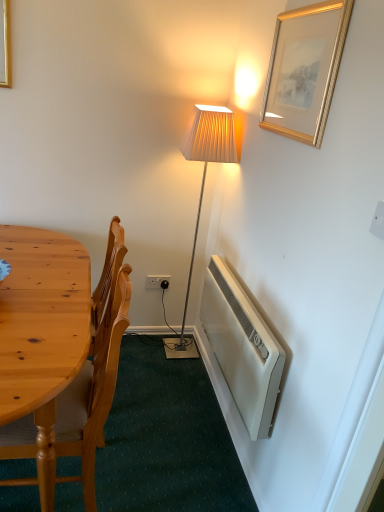
The height and width of the screenshot is (512, 384). In order to click on wooden chair at left in this screenshot , I will do `click(92, 396)`.

What is the approximate width of wooden chair at left?

It is 20.51 inches.

Describe the element at coordinates (305, 69) in the screenshot. The width and height of the screenshot is (384, 512). I see `gold/gilded picture frame at upper right` at that location.

This screenshot has height=512, width=384. I want to click on gold/gilded picture frame at upper right, so click(x=305, y=69).

Identify the location of white plastic radiator at lower right. The image size is (384, 512). (242, 347).

Measure the distance between point (x=242, y=315) and camera.

Point (x=242, y=315) is 5.57 feet from camera.

I want to click on white plastic power outlet at lower center, so click(157, 281).

How far apart are white plastic radiator at lower right and wooden chair at left?

white plastic radiator at lower right is 58.57 centimeters from wooden chair at left.

Looking at this image, between white plastic radiator at lower right and wooden chair at left, which one has more height?

Standing taller between the two is wooden chair at left.

From the image's perspective, is white plastic radiator at lower right below wooden chair at left?

No, from the image's perspective, white plastic radiator at lower right is not beneath wooden chair at left.

In the image, is white plastic radiator at lower right positioned in front of or behind wooden chair at left?

white plastic radiator at lower right is positioned farther from the viewer than wooden chair at left.

In the scene shown: Does wooden chair at left touch white plastic radiator at lower right?

They are not placed beside each other.

Which of these two, wooden chair at left or white plastic radiator at lower right, stands shorter?

white plastic radiator at lower right.

Between wooden chair at left and white plastic radiator at lower right, which one has larger width?

wooden chair at left.

From a real-world perspective, is wooden chair at left on top of white plastic radiator at lower right?

No, from a real-world perspective, wooden chair at left is not on top of white plastic radiator at lower right.

Can you confirm if wooden chair at left is shorter than gold/gilded picture frame at upper right?

No, wooden chair at left is not shorter than gold/gilded picture frame at upper right.

Is wooden chair at left surrounding gold/gilded picture frame at upper right?

No.

From the image's perspective, which one is positioned higher, wooden chair at left or gold/gilded picture frame at upper right?

gold/gilded picture frame at upper right, from the image's perspective.

Between wooden chair at left and gold/gilded picture frame at upper right, which one appears on the right side from the viewer's perspective?

Positioned to the right is gold/gilded picture frame at upper right.

Based on the photo, are wooden chair at left and white plastic power outlet at lower center far apart?

Indeed, wooden chair at left is not near white plastic power outlet at lower center.

From the picture: Is wooden chair at left not within white plastic power outlet at lower center?

wooden chair at left lies outside white plastic power outlet at lower center's area.

Considering the points (114, 360) and (160, 283), which point is in front, point (114, 360) or point (160, 283)?

The point (114, 360) is more forward.

Can you confirm if wooden chair at left is wider than white plastic power outlet at lower center?

Correct, the width of wooden chair at left exceeds that of white plastic power outlet at lower center.

Locate an element on the screen. The image size is (384, 512). radiator that is on the left side of gold/gilded picture frame at upper right is located at coordinates (242, 347).

Is white plastic radiator at lower right with gold/gilded picture frame at upper right?

There is a gap between white plastic radiator at lower right and gold/gilded picture frame at upper right.

From a real-world perspective, which is physically below, white plastic power outlet at lower center or wooden chair at left?

From a 3D spatial view, white plastic power outlet at lower center is below.

Locate an element on the screen. chair lying on the left of white plastic power outlet at lower center is located at coordinates (92, 396).

Consider the image. Are white plastic power outlet at lower center and wooden chair at left beside each other?

No, white plastic power outlet at lower center is not beside wooden chair at left.

Consider the image. Would you say white plastic radiator at lower right is outside white plastic power outlet at lower center?

That's correct, white plastic radiator at lower right is outside of white plastic power outlet at lower center.

From the picture: Is white plastic radiator at lower right looking in the opposite direction of white plastic power outlet at lower center?

That's not correct — white plastic radiator at lower right is not looking away from white plastic power outlet at lower center.

Does white plastic radiator at lower right have a greater width compared to white plastic power outlet at lower center?

Yes, white plastic radiator at lower right is wider than white plastic power outlet at lower center.

Image resolution: width=384 pixels, height=512 pixels. In order to click on radiator lying above the wooden chair at left (from the image's perspective) in this screenshot , I will do `click(242, 347)`.

What are the coordinates of `chair that is below the white plastic radiator at lower right (from the image's perspective)` in the screenshot? It's located at (92, 396).

Considering their positions, is white plastic radiator at lower right positioned further to gold/gilded picture frame at upper right than white plastic power outlet at lower center?

Based on the image, white plastic power outlet at lower center appears to be further to gold/gilded picture frame at upper right.

Based on their spatial positions, is white plastic radiator at lower right or gold/gilded picture frame at upper right further from wooden chair at left?

gold/gilded picture frame at upper right.

Based on their spatial positions, is white plastic radiator at lower right or white plastic power outlet at lower center further from wooden chair at left?

white plastic power outlet at lower center.

Estimate the real-world distances between objects in this image. Which object is closer to gold/gilded picture frame at upper right, white plastic radiator at lower right or wooden chair at left?

white plastic radiator at lower right.

From the image, which object appears to be nearer to white plastic radiator at lower right, white plastic power outlet at lower center or wooden chair at left?

Among the two, wooden chair at left is located nearer to white plastic radiator at lower right.

From the image, which object appears to be farther from gold/gilded picture frame at upper right, white plastic power outlet at lower center or white plastic radiator at lower right?

white plastic power outlet at lower center is positioned further to the anchor gold/gilded picture frame at upper right.

When comparing their distances from white plastic power outlet at lower center, does white plastic radiator at lower right or wooden chair at left seem closer?

Among the two, white plastic radiator at lower right is located nearer to white plastic power outlet at lower center.

From the image, which object appears to be farther from white plastic radiator at lower right, gold/gilded picture frame at upper right or wooden chair at left?

gold/gilded picture frame at upper right lies further to white plastic radiator at lower right than the other object.

Identify the location of radiator between gold/gilded picture frame at upper right and wooden chair at left in the up-down direction. (242, 347).

This screenshot has height=512, width=384. Find the location of `picture frame between wooden chair at left and white plastic power outlet at lower center along the z-axis`. picture frame between wooden chair at left and white plastic power outlet at lower center along the z-axis is located at coordinates (305, 69).

You are a GUI agent. You are given a task and a screenshot of the screen. Output one action in this format:
    pyautogui.click(x=<x>, y=<y>)
    Task: Click on the radiator positioned between gold/gilded picture frame at upper right and white plastic power outlet at lower center from near to far
    The height and width of the screenshot is (512, 384).
    Given the screenshot: What is the action you would take?
    point(242,347)

Identify the location of radiator between wooden chair at left and white plastic power outlet at lower center in the front-back direction. This screenshot has height=512, width=384. (242, 347).